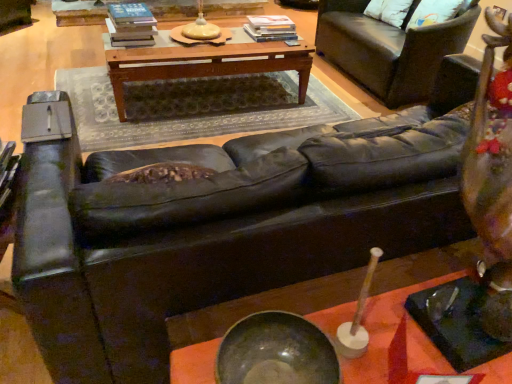
Question: In which direction should I rotate to look at metallic bowl at center, placed as the first table when sorted from front to back?

Choices:
 (A) left
 (B) right

Answer: (B)

Question: Considering the relative positions of white soft pillow at upper right and dark brown leather mat at center in the image provided, is white soft pillow at upper right in front of dark brown leather mat at center?

Choices:
 (A) no
 (B) yes

Answer: (A)

Question: Considering the relative positions of white soft pillow at upper right and dark brown leather mat at center in the image provided, is white soft pillow at upper right to the left of dark brown leather mat at center from the viewer's perspective?

Choices:
 (A) yes
 (B) no

Answer: (B)

Question: Is white soft pillow at upper right wider than dark brown leather mat at center?

Choices:
 (A) yes
 (B) no

Answer: (B)

Question: Is white soft pillow at upper right thinner than dark brown leather mat at center?

Choices:
 (A) yes
 (B) no

Answer: (A)

Question: From a real-world perspective, is white soft pillow at upper right physically above dark brown leather mat at center?

Choices:
 (A) yes
 (B) no

Answer: (A)

Question: Is white soft pillow at upper right shorter than dark brown leather mat at center?

Choices:
 (A) yes
 (B) no

Answer: (B)

Question: Is woodenobject at center, the second table from the bottom, not inside white soft pillow at upper right?

Choices:
 (A) yes
 (B) no

Answer: (A)

Question: Is woodenobject at center, the first table in the top-to-bottom sequence, behind white soft pillow at upper right?

Choices:
 (A) yes
 (B) no

Answer: (B)

Question: From a real-world perspective, does woodenobject at center, which is the first table in back-to-front order, sit lower than white soft pillow at upper right?

Choices:
 (A) yes
 (B) no

Answer: (A)

Question: Does woodenobject at center, which is the first table in back-to-front order, appear on the left side of white soft pillow at upper right?

Choices:
 (A) no
 (B) yes

Answer: (B)

Question: Considering the relative sizes of woodenobject at center, which is the first table in back-to-front order, and white soft pillow at upper right in the image provided, is woodenobject at center, which is the first table in back-to-front order, taller than white soft pillow at upper right?

Choices:
 (A) no
 (B) yes

Answer: (B)

Question: Can you see woodenobject at center, placed as the second table when sorted from front to back, touching white soft pillow at upper right?

Choices:
 (A) no
 (B) yes

Answer: (A)

Question: From the image's perspective, is metallic bowl at center, placed as the first table when sorted from front to back, on top of dark brown leather mat at center?

Choices:
 (A) yes
 (B) no

Answer: (B)